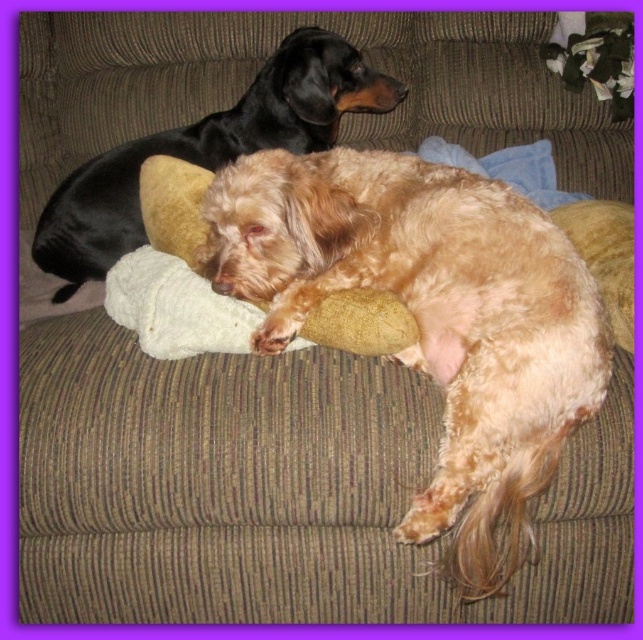
Is fuzzy golden dog at center to the right of shiny black dog at upper left from the viewer's perspective?

Correct, you'll find fuzzy golden dog at center to the right of shiny black dog at upper left.

Locate an element on the screen. Image resolution: width=643 pixels, height=640 pixels. fuzzy golden dog at center is located at coordinates coord(431,317).